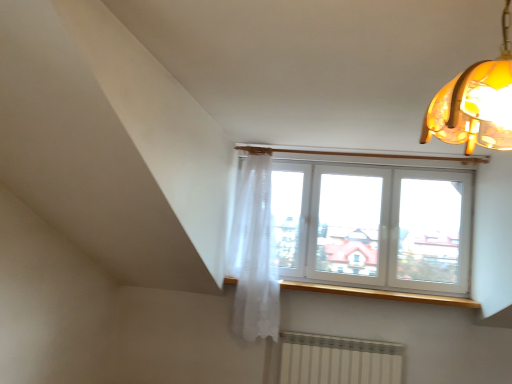
Where is `empty space that is ontop of white sheer curtain at upper center`? This screenshot has width=512, height=384. empty space that is ontop of white sheer curtain at upper center is located at coordinates (266, 148).